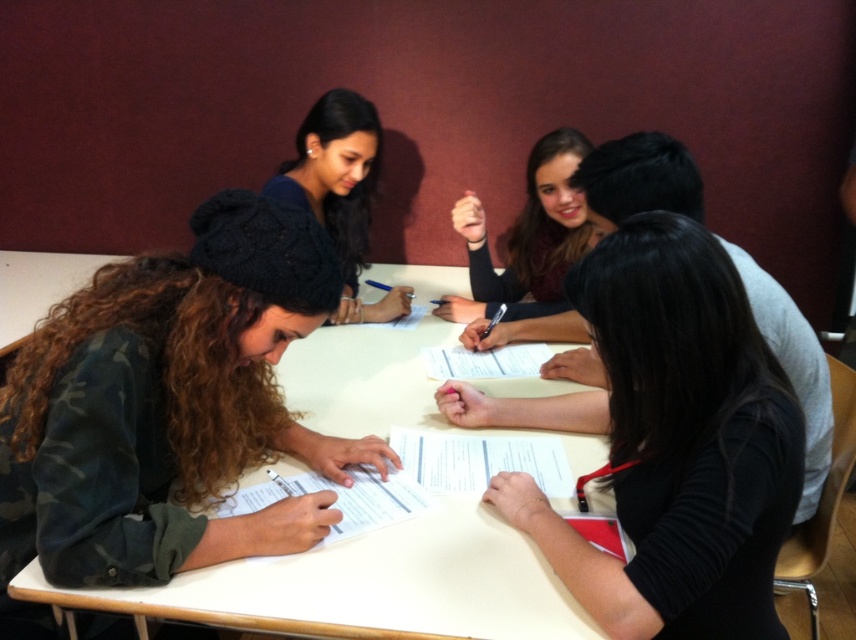
Question: Which of the following is the farthest from the observer?

Choices:
 (A) black matte hair at center
 (B) camo fabric beanie at lower left
 (C) smooth black hair at center
 (D) white paper at center

Answer: (C)

Question: Which of the following is the farthest from the observer?

Choices:
 (A) (328, 100)
 (B) (312, 337)
 (C) (200, 362)
 (D) (770, 388)

Answer: (A)

Question: Can you confirm if white paper at center is positioned above smooth black hair at center?

Choices:
 (A) no
 (B) yes

Answer: (A)

Question: Considering the real-world distances, which object is closest to the smooth black hair at center?

Choices:
 (A) matte black beanie at upper center
 (B) white paper at center
 (C) black matte hair at center
 (D) camo fabric beanie at lower left

Answer: (A)

Question: Does black matte hair at center have a lesser width compared to smooth black hair at center?

Choices:
 (A) yes
 (B) no

Answer: (B)

Question: Is black matte hair at center positioned in front of white paper at center?

Choices:
 (A) no
 (B) yes

Answer: (B)